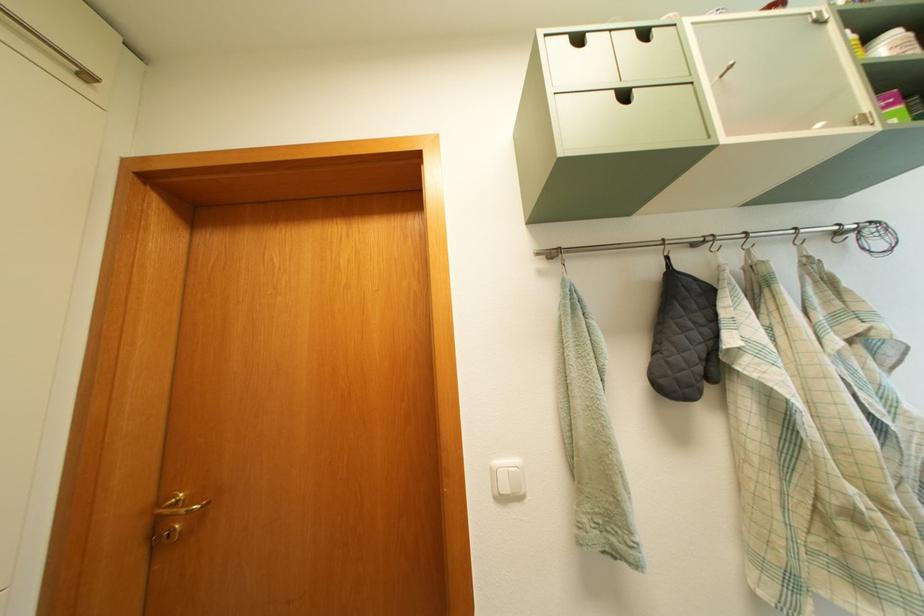
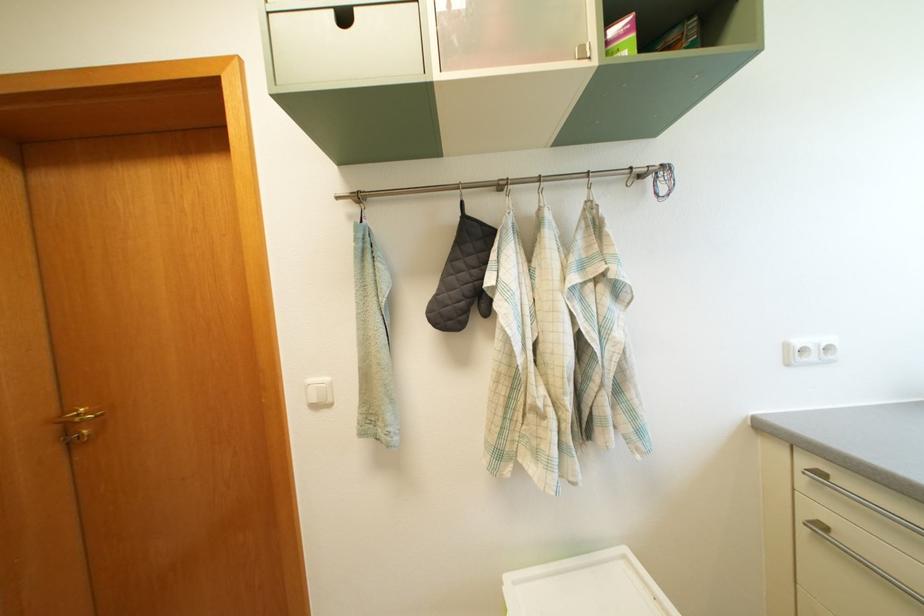
In the second image, find the point that corresponds to (x=673, y=277) in the first image.

(468, 222)